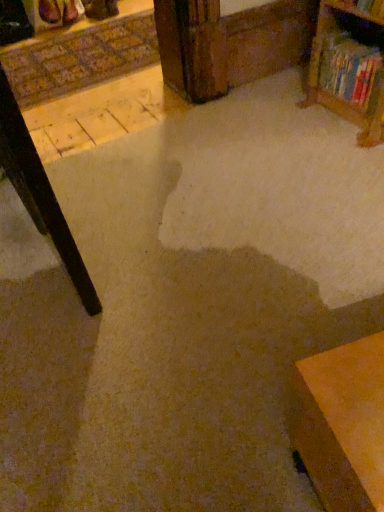
Describe the element at coordinates (359, 9) in the screenshot. I see `wooden bookshelf at upper right` at that location.

The height and width of the screenshot is (512, 384). Identify the location of wooden bookshelf at upper right. (359, 9).

Find the location of `hardcover book at upper right`. hardcover book at upper right is located at coordinates (349, 68).

Describe the element at coordinates (349, 68) in the screenshot. The width and height of the screenshot is (384, 512). I see `hardcover book at upper right` at that location.

In the scene shown: Measure the distance between hardcover book at upper right and camera.

The depth of hardcover book at upper right is 1.62 meters.

Find the location of a particular element. wooden bookshelf at upper right is located at coordinates (359, 9).

Which object is positioned more to the left, wooden bookshelf at upper right or hardcover book at upper right?

wooden bookshelf at upper right.

In the image, is wooden bookshelf at upper right positioned in front of or behind hardcover book at upper right?

In the image, wooden bookshelf at upper right appears in front of hardcover book at upper right.

Which point is more distant from viewer, (339, 0) or (319, 69)?

The point (319, 69) is farther from the camera.

From the image's perspective, is wooden bookshelf at upper right located above or below hardcover book at upper right?

wooden bookshelf at upper right is situated higher than hardcover book at upper right in the image.

From a real-world perspective, is wooden bookshelf at upper right on top of hardcover book at upper right?

Yes, from a real-world perspective, wooden bookshelf at upper right is above hardcover book at upper right.

In terms of width, does wooden bookshelf at upper right look wider or thinner when compared to hardcover book at upper right?

Clearly, wooden bookshelf at upper right has less width compared to hardcover book at upper right.

Does wooden bookshelf at upper right have a lesser height compared to hardcover book at upper right?

Correct, wooden bookshelf at upper right is not as tall as hardcover book at upper right.

Considering the sizes of objects wooden bookshelf at upper right and hardcover book at upper right in the image provided, who is smaller, wooden bookshelf at upper right or hardcover book at upper right?

wooden bookshelf at upper right is smaller.

Would you say wooden bookshelf at upper right is outside hardcover book at upper right?

Yes, wooden bookshelf at upper right is located beyond the bounds of hardcover book at upper right.

Is wooden bookshelf at upper right not close to hardcover book at upper right?

Answer: No, there isn't a large distance between wooden bookshelf at upper right and hardcover book at upper right.

Is wooden bookshelf at upper right oriented towards hardcover book at upper right?

No, wooden bookshelf at upper right is not facing towards hardcover book at upper right.

What's the angular difference between wooden bookshelf at upper right and hardcover book at upper right's facing directions?

They differ by 0.00105 degrees in their facing directions.

Locate an element on the screen. This screenshot has width=384, height=512. book behind the wooden bookshelf at upper right is located at coordinates (349, 68).

Can you confirm if hardcover book at upper right is positioned to the right of wooden bookshelf at upper right?

Indeed, hardcover book at upper right is positioned on the right side of wooden bookshelf at upper right.

Considering the positions of objects hardcover book at upper right and wooden bookshelf at upper right in the image provided, who is behind, hardcover book at upper right or wooden bookshelf at upper right?

Positioned behind is hardcover book at upper right.

Consider the image. Which is closer to the camera, (370,92) or (347,5)?

Point (370,92).

From the image's perspective, is hardcover book at upper right on wooden bookshelf at upper right?

No.

From a real-world perspective, is hardcover book at upper right on top of wooden bookshelf at upper right?

No, from a real-world perspective, hardcover book at upper right is not above wooden bookshelf at upper right.

Considering the relative sizes of hardcover book at upper right and wooden bookshelf at upper right in the image provided, is hardcover book at upper right wider than wooden bookshelf at upper right?

Indeed, hardcover book at upper right has a greater width compared to wooden bookshelf at upper right.

Looking at this image, between hardcover book at upper right and wooden bookshelf at upper right, which one has more height?

hardcover book at upper right is taller.

Considering the relative sizes of hardcover book at upper right and wooden bookshelf at upper right in the image provided, is hardcover book at upper right bigger than wooden bookshelf at upper right?

Indeed, hardcover book at upper right has a larger size compared to wooden bookshelf at upper right.

Is hardcover book at upper right outside of wooden bookshelf at upper right?

Yes, hardcover book at upper right is not within wooden bookshelf at upper right.

Is hardcover book at upper right next to wooden bookshelf at upper right?

There is a gap between hardcover book at upper right and wooden bookshelf at upper right.

Is hardcover book at upper right looking in the opposite direction of wooden bookshelf at upper right?

hardcover book at upper right is not turned away from wooden bookshelf at upper right.

Locate an element on the screen. The image size is (384, 512). shelf located above the hardcover book at upper right (from a real-world perspective) is located at coordinates [x=359, y=9].

The image size is (384, 512). I want to click on book below the wooden bookshelf at upper right (from a real-world perspective), so click(349, 68).

Identify the location of shelf in front of the hardcover book at upper right. This screenshot has width=384, height=512. (359, 9).